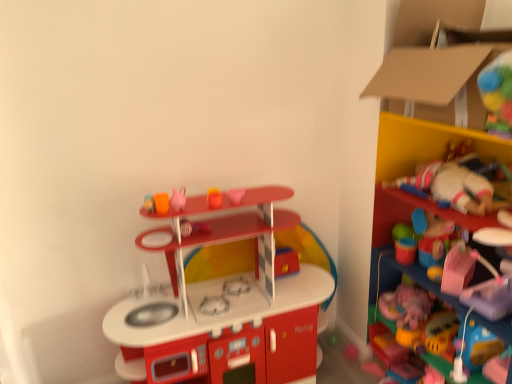
Describe the element at coordinates (400, 277) in the screenshot. Image resolution: width=512 pixels, height=384 pixels. I see `rubberized plastic toys at right, which appears as the 1th shelf when ordered from the bottom` at that location.

The height and width of the screenshot is (384, 512). In order to click on matte plastic toy kitchen at center, the sixth toy in the top-to-bottom sequence in this screenshot , I will do `click(223, 303)`.

What do you see at coordinates (413, 173) in the screenshot? I see `plush fabric stuffed animal at right, which is the first shelf in top-to-bottom order` at bounding box center [413, 173].

What is the approximate width of pink matte heart at upper center, the 6th toy ordered from the bottom?

9.63 centimeters.

This screenshot has height=384, width=512. Describe the element at coordinates (234, 195) in the screenshot. I see `pink matte heart at upper center, the 6th toy ordered from the bottom` at that location.

I want to click on rubberized plastic toys at right, the 2th shelf positioned from the top, so click(x=400, y=277).

Can you tell me how much matte pink teapot at upper center, positioned as the fifth toy in bottom-to-top order, and pink matte heart at upper center, the 6th toy ordered from the bottom, differ in facing direction?

matte pink teapot at upper center, positioned as the fifth toy in bottom-to-top order, and pink matte heart at upper center, the 6th toy ordered from the bottom, are facing 0.00492 degrees away from each other.

Can you confirm if matte pink teapot at upper center, arranged as the 2th toy when viewed from the top, is shorter than pink matte heart at upper center, the 6th toy ordered from the bottom?

In fact, matte pink teapot at upper center, arranged as the 2th toy when viewed from the top, may be taller than pink matte heart at upper center, the 6th toy ordered from the bottom.

From a real-world perspective, is matte pink teapot at upper center, arranged as the 2th toy when viewed from the top, physically below pink matte heart at upper center, the 6th toy ordered from the bottom?

No, from a real-world perspective, matte pink teapot at upper center, arranged as the 2th toy when viewed from the top, is not below pink matte heart at upper center, the 6th toy ordered from the bottom.

Which object is further away from the camera taking this photo, matte pink teapot at upper center, positioned as the fifth toy in bottom-to-top order, or pink matte heart at upper center, which is the first toy in top-to-bottom order?

pink matte heart at upper center, which is the first toy in top-to-bottom order, is further from the camera.

Starting from the matte plastic cup at center, the third toy from the bottom, which toy is the 2nd one to the right? Please provide its 2D coordinates.

[(223, 303)]

How many degrees apart are the facing directions of matte plastic toy kitchen at center, the sixth toy in the top-to-bottom sequence, and matte plastic cup at center, the third toy from the bottom?

1.28 degrees.

Does matte plastic toy kitchen at center, the first toy from the bottom, lie in front of matte plastic cup at center, the third toy from the bottom?

Yes, it is in front of matte plastic cup at center, the third toy from the bottom.

From a real-world perspective, is matte plastic toy kitchen at center, the first toy from the bottom, physically located above or below matte plastic cup at center, the third toy from the bottom?

From a real-world perspective, matte plastic toy kitchen at center, the first toy from the bottom, is physically below matte plastic cup at center, the third toy from the bottom.

Is cardboard at upper right not inside plush fabric stuffed animal at right, which is the first shelf in top-to-bottom order?

Indeed, cardboard at upper right is completely outside plush fabric stuffed animal at right, which is the first shelf in top-to-bottom order.

Is point (444, 117) positioned before point (380, 143)?

Yes.

From the image's perspective, who appears lower, cardboard at upper right or plush fabric stuffed animal at right, marked as the 2th shelf in a bottom-to-top arrangement?

From the image's view, plush fabric stuffed animal at right, marked as the 2th shelf in a bottom-to-top arrangement, is below.

Is there a large distance between cardboard at upper right and plush fabric stuffed animal at right, which is the first shelf in top-to-bottom order?

That's not correct — cardboard at upper right is a little close to plush fabric stuffed animal at right, which is the first shelf in top-to-bottom order.

From the pink matte heart at upper center, the 6th toy ordered from the bottom, count 1st shelfs forward and point to it. Please provide its 2D coordinates.

[(400, 277)]

Consider the image. Considering the relative positions of rubberized plastic toys at right, which appears as the 1th shelf when ordered from the bottom, and pink matte heart at upper center, which is the first toy in top-to-bottom order, in the image provided, is rubberized plastic toys at right, which appears as the 1th shelf when ordered from the bottom, to the left or to the right of pink matte heart at upper center, which is the first toy in top-to-bottom order,?

From the image, it's evident that rubberized plastic toys at right, which appears as the 1th shelf when ordered from the bottom, is to the right of pink matte heart at upper center, which is the first toy in top-to-bottom order.

Is point (382, 261) positioned in front of point (228, 191)?

No.

Is the surface of rubberized plastic toys at right, the 2th shelf positioned from the top, in direct contact with pink matte heart at upper center, the 6th toy ordered from the bottom?

No, rubberized plastic toys at right, the 2th shelf positioned from the top, is not next to pink matte heart at upper center, the 6th toy ordered from the bottom.

Is matte pink teapot at upper center, positioned as the fifth toy in bottom-to-top order, with rubberized plastic toys at right, which appears as the 1th shelf when ordered from the bottom?

matte pink teapot at upper center, positioned as the fifth toy in bottom-to-top order, is not next to rubberized plastic toys at right, which appears as the 1th shelf when ordered from the bottom, and they're not touching.

Is the depth of matte pink teapot at upper center, positioned as the fifth toy in bottom-to-top order, less than that of rubberized plastic toys at right, the 2th shelf positioned from the top?

That is False.

Between matte pink teapot at upper center, positioned as the fifth toy in bottom-to-top order, and rubberized plastic toys at right, the 2th shelf positioned from the top, which one has smaller width?

matte pink teapot at upper center, positioned as the fifth toy in bottom-to-top order.

From the image's perspective, is matte pink teapot at upper center, arranged as the 2th toy when viewed from the top, on top of rubberized plastic toys at right, the 2th shelf positioned from the top?

Yes, from the image's perspective, matte pink teapot at upper center, arranged as the 2th toy when viewed from the top, is on top of rubberized plastic toys at right, the 2th shelf positioned from the top.

In the scene shown: How many degrees apart are the facing directions of rubberized plastic toys at right, the 2th shelf positioned from the top, and smooth plastic cup at upper center, marked as the third toy in a top-to-bottom arrangement?

The angle between the facing direction of rubberized plastic toys at right, the 2th shelf positioned from the top, and the facing direction of smooth plastic cup at upper center, marked as the third toy in a top-to-bottom arrangement, is 87.9 degrees.

From a real-world perspective, which is physically below, rubberized plastic toys at right, which appears as the 1th shelf when ordered from the bottom, or smooth plastic cup at upper center, which is the 4th toy in bottom-to-top order?

From a 3D spatial view, rubberized plastic toys at right, which appears as the 1th shelf when ordered from the bottom, is below.

From the image's perspective, count 4th toys upward from the rubberized plastic toys at right, which appears as the 1th shelf when ordered from the bottom, and point to it. Please provide its 2D coordinates.

[(214, 197)]

From the image's perspective, is rubberized plastic toys at right, the 2th shelf positioned from the top, located above or below smooth plastic cup at upper center, which is the 4th toy in bottom-to-top order?

Based on their image positions, rubberized plastic toys at right, the 2th shelf positioned from the top, is located beneath smooth plastic cup at upper center, which is the 4th toy in bottom-to-top order.

Is rubberized plastic toys at right, the 2th shelf positioned from the top, to the left or to the right of matte pink teapot at upper center, positioned as the fifth toy in bottom-to-top order, in the image?

Clearly, rubberized plastic toys at right, the 2th shelf positioned from the top, is on the right of matte pink teapot at upper center, positioned as the fifth toy in bottom-to-top order, in the image.

Is rubberized plastic toys at right, the 2th shelf positioned from the top, turned away from matte pink teapot at upper center, positioned as the fifth toy in bottom-to-top order?

No, rubberized plastic toys at right, the 2th shelf positioned from the top, is not facing away from matte pink teapot at upper center, positioned as the fifth toy in bottom-to-top order.

Is rubberized plastic toys at right, which appears as the 1th shelf when ordered from the bottom, in contact with matte pink teapot at upper center, positioned as the fifth toy in bottom-to-top order?

rubberized plastic toys at right, which appears as the 1th shelf when ordered from the bottom, and matte pink teapot at upper center, positioned as the fifth toy in bottom-to-top order, are not in contact.

From a real-world perspective, which toy is the 2nd one above the pink matte heart at upper center, the 6th toy ordered from the bottom? Please provide its 2D coordinates.

[(178, 199)]

Identify the location of toy that is the 2nd one when counting leftward from the matte plastic toy kitchen at center, the first toy from the bottom. The height and width of the screenshot is (384, 512). (193, 227).

Based on their spatial positions, is rubberized plastic toys at right, which appears as the 1th shelf when ordered from the bottom, or shiny plastic toy at center, acting as the 5th toy starting from the top, closer to pink matte heart at upper center, the 6th toy ordered from the bottom?

shiny plastic toy at center, acting as the 5th toy starting from the top, lies closer to pink matte heart at upper center, the 6th toy ordered from the bottom, than the other object.

Looking at the image, which one is located closer to rubberized plastic toys at right, which appears as the 1th shelf when ordered from the bottom, pink matte heart at upper center, which is the first toy in top-to-bottom order, or shiny plastic toy at center, placed as the second toy when sorted from bottom to top?

Among the two, shiny plastic toy at center, placed as the second toy when sorted from bottom to top, is located nearer to rubberized plastic toys at right, which appears as the 1th shelf when ordered from the bottom.

Considering their positions, is cardboard at upper right positioned further to pink matte heart at upper center, which is the first toy in top-to-bottom order, than matte plastic cup at center, the third toy from the bottom?

cardboard at upper right is further to pink matte heart at upper center, which is the first toy in top-to-bottom order.

Consider the image. Looking at the image, which one is located further to matte pink teapot at upper center, arranged as the 2th toy when viewed from the top, rubberized plastic toys at right, which appears as the 1th shelf when ordered from the bottom, or matte plastic toy kitchen at center, the sixth toy in the top-to-bottom sequence?

rubberized plastic toys at right, which appears as the 1th shelf when ordered from the bottom, lies further to matte pink teapot at upper center, arranged as the 2th toy when viewed from the top, than the other object.

From the image, which object appears to be farther from cardboard at upper right, matte pink teapot at upper center, positioned as the fifth toy in bottom-to-top order, or plush fabric stuffed animal at right, which is the first shelf in top-to-bottom order?

matte pink teapot at upper center, positioned as the fifth toy in bottom-to-top order, is positioned further to the anchor cardboard at upper right.

When comparing their distances from plush fabric stuffed animal at right, marked as the 2th shelf in a bottom-to-top arrangement, does pink matte heart at upper center, which is the first toy in top-to-bottom order, or rubberized plastic toys at right, which appears as the 1th shelf when ordered from the bottom, seem closer?

rubberized plastic toys at right, which appears as the 1th shelf when ordered from the bottom, is positioned closer to the anchor plush fabric stuffed animal at right, marked as the 2th shelf in a bottom-to-top arrangement.

From the image, which object appears to be farther from matte plastic cup at center, which ranks as the 4th toy in top-to-bottom order, matte plastic toy kitchen at center, the first toy from the bottom, or pink matte heart at upper center, which is the first toy in top-to-bottom order?

Based on the image, matte plastic toy kitchen at center, the first toy from the bottom, appears to be further to matte plastic cup at center, which ranks as the 4th toy in top-to-bottom order.

Based on their spatial positions, is matte plastic cup at center, the third toy from the bottom, or matte pink teapot at upper center, arranged as the 2th toy when viewed from the top, further from matte plastic toy kitchen at center, the sixth toy in the top-to-bottom sequence?

matte pink teapot at upper center, arranged as the 2th toy when viewed from the top, is further to matte plastic toy kitchen at center, the sixth toy in the top-to-bottom sequence.

The height and width of the screenshot is (384, 512). I want to click on shelf situated between matte plastic cup at center, the third toy from the bottom, and plush fabric stuffed animal at right, marked as the 2th shelf in a bottom-to-top arrangement, from left to right, so click(400, 277).

Find the location of a particular element. The image size is (512, 384). cardboard box situated between pink matte heart at upper center, which is the first toy in top-to-bottom order, and plush fabric stuffed animal at right, which is the first shelf in top-to-bottom order, from left to right is located at coordinates (437, 63).

The image size is (512, 384). Identify the location of cardboard box between matte plastic toy kitchen at center, the first toy from the bottom, and plush fabric stuffed animal at right, marked as the 2th shelf in a bottom-to-top arrangement, in the horizontal direction. (437, 63).

Where is `shelf between matte plastic cup at center, which ranks as the 4th toy in top-to-bottom order, and cardboard at upper right from left to right`? The height and width of the screenshot is (384, 512). shelf between matte plastic cup at center, which ranks as the 4th toy in top-to-bottom order, and cardboard at upper right from left to right is located at coordinates (400, 277).